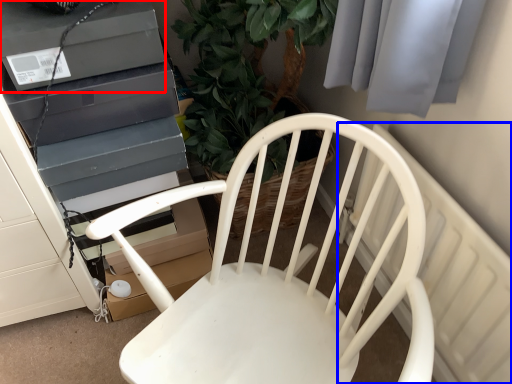
Question: Among these objects, which one is nearest to the camera, appliance (highlighted by a red box) or radiator (highlighted by a blue box)?

Choices:
 (A) appliance
 (B) radiator

Answer: (B)